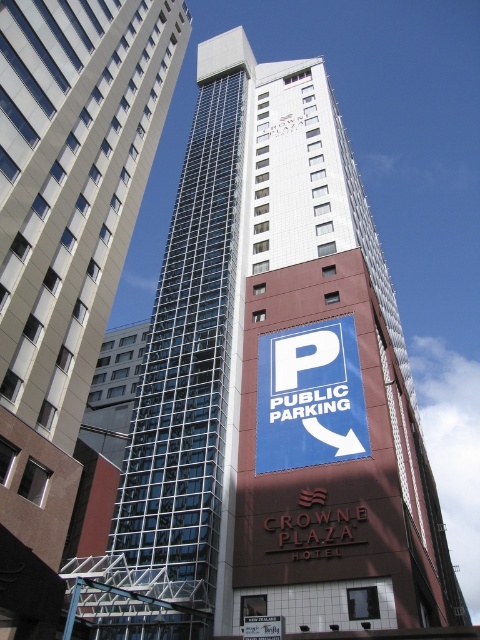
Question: Which of the following is the farthest from the observer?

Choices:
 (A) blue paper sign at center
 (B) glassy steel skyscraper at center

Answer: (A)

Question: Can you confirm if glassy steel skyscraper at center is positioned below blue paper sign at center?

Choices:
 (A) yes
 (B) no

Answer: (B)

Question: Which object appears closest to the camera in this image?

Choices:
 (A) blue paper sign at center
 (B) glassy steel skyscraper at center

Answer: (B)

Question: Does glassy steel skyscraper at center have a smaller size compared to blue paper sign at center?

Choices:
 (A) yes
 (B) no

Answer: (B)

Question: Is glassy steel skyscraper at center further to camera compared to blue paper sign at center?

Choices:
 (A) yes
 (B) no

Answer: (B)